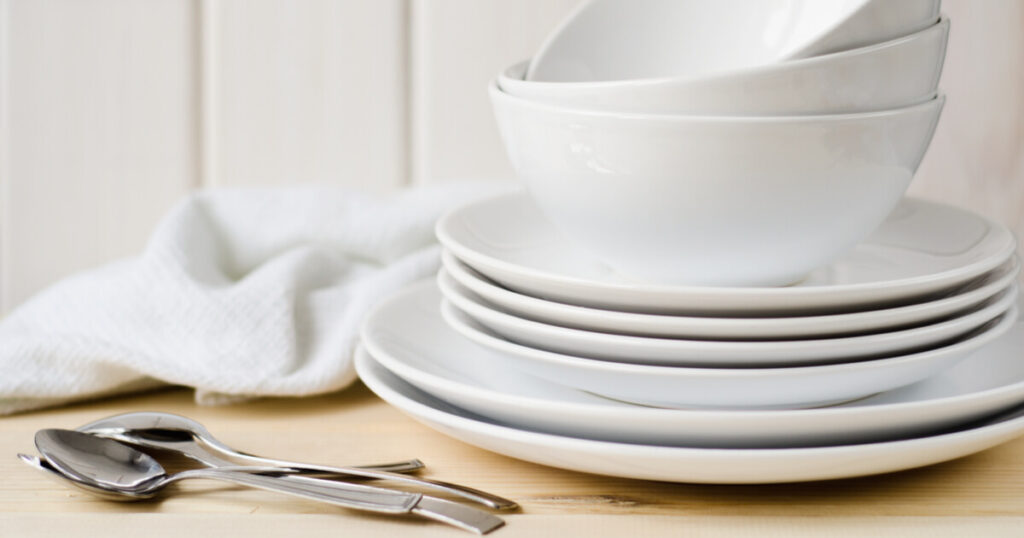
Where is `plates`? This screenshot has width=1024, height=538. plates is located at coordinates pyautogui.click(x=707, y=467), pyautogui.click(x=707, y=433), pyautogui.click(x=712, y=389), pyautogui.click(x=723, y=350), pyautogui.click(x=718, y=325), pyautogui.click(x=722, y=298).